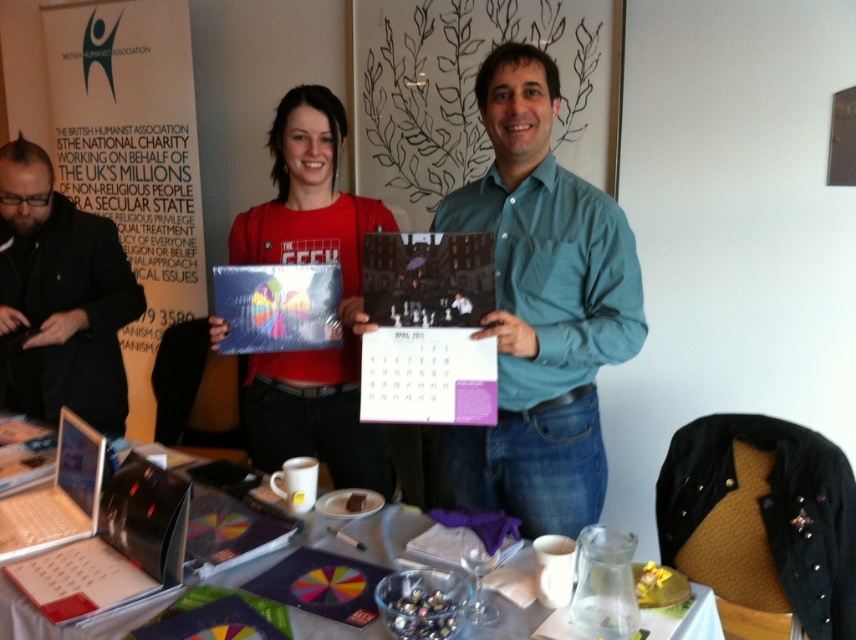
Based on the photo, you are organizing an event and need to place a name tag on the table. The name tag is 10 cm wide. Can you fit it on the translucent plastic table at center without overlapping the matte red shirt at center?

The matte red shirt at center is positioned on the left side of the translucent plastic table at center. Since the shirt is on the left, placing the name tag on the right side of the table would avoid overlapping. Therefore, the name tag can be placed on the translucent plastic table at center without overlapping the matte red shirt at center.

You are a photographer positioned to take a photo of the scene. Your focus is set to the translucent plastic table at center. Will the matte red shirt at center be in focus or out of focus?

The matte red shirt at center is further to the viewer than the translucent plastic table at center. Since the focus is set on the table, the shirt would be out of focus as it is closer to the camera.